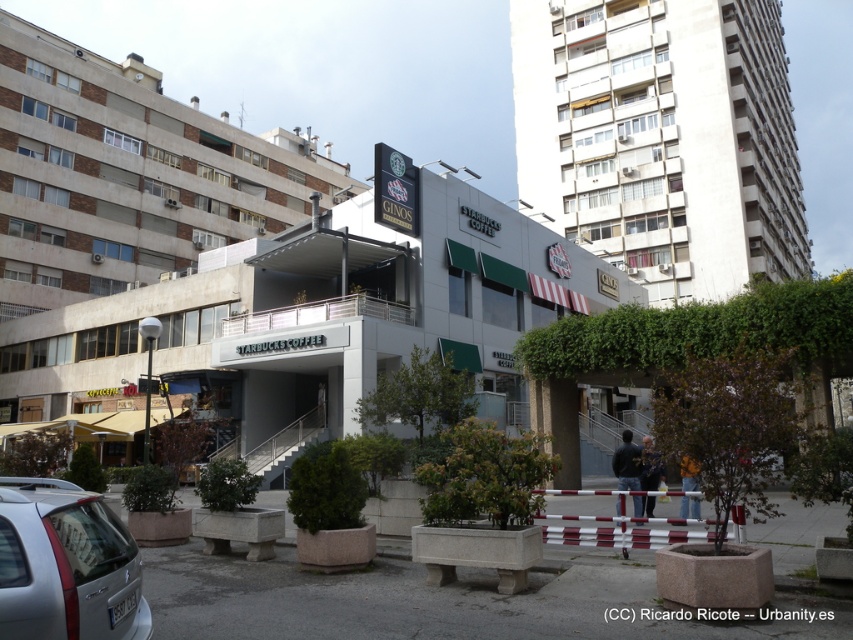
You are a delivery person who needs to park your 15 feet long truck between the white concrete building at center and the silver metallic car at lower left. Is there enough space between them to park your truck?

The distance between the white concrete building at center and the silver metallic car at lower left is 69.24 feet, which is more than enough to park a 15 feet long truck between them.

You are a delivery driver who needs to drop off a package at the Starbucks Coffee shop. You are currently positioned at the white concrete building at upper right. Based on your current location, in which direction should you head to reach Starbucks?

The white concrete building at upper right is located at point (662, 138). Since Starbucks is adjacent to it, you should move towards the direction where the Starbucks signage is visible from your current position at the white concrete building at upper right.